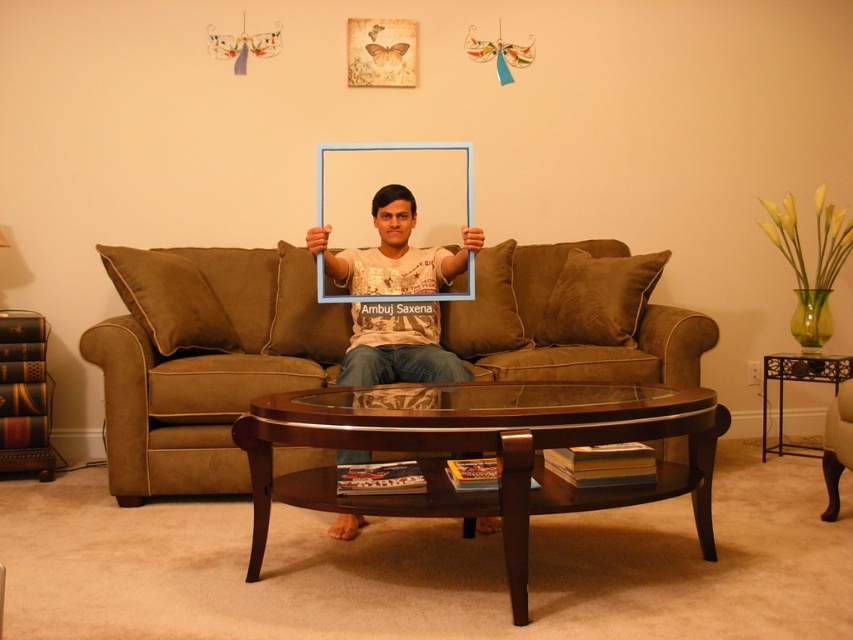
Question: Can you confirm if brown suede couch at center is positioned to the right of matte white t-shirt at center?

Choices:
 (A) no
 (B) yes

Answer: (A)

Question: Which point is farther from the camera taking this photo?

Choices:
 (A) (457, 273)
 (B) (200, 449)
 (C) (434, 211)

Answer: (C)

Question: Can you confirm if brown suede couch at center is positioned above matte white t-shirt at center?

Choices:
 (A) yes
 (B) no

Answer: (B)

Question: Considering the real-world distances, which object is farthest from the matte white t-shirt at center?

Choices:
 (A) brown suede couch at center
 (B) blue plastic picture frame at center

Answer: (A)

Question: Does matte white t-shirt at center have a smaller size compared to blue plastic picture frame at center?

Choices:
 (A) yes
 (B) no

Answer: (B)

Question: Which of the following is the farthest from the observer?

Choices:
 (A) (450, 296)
 (B) (227, 301)

Answer: (B)